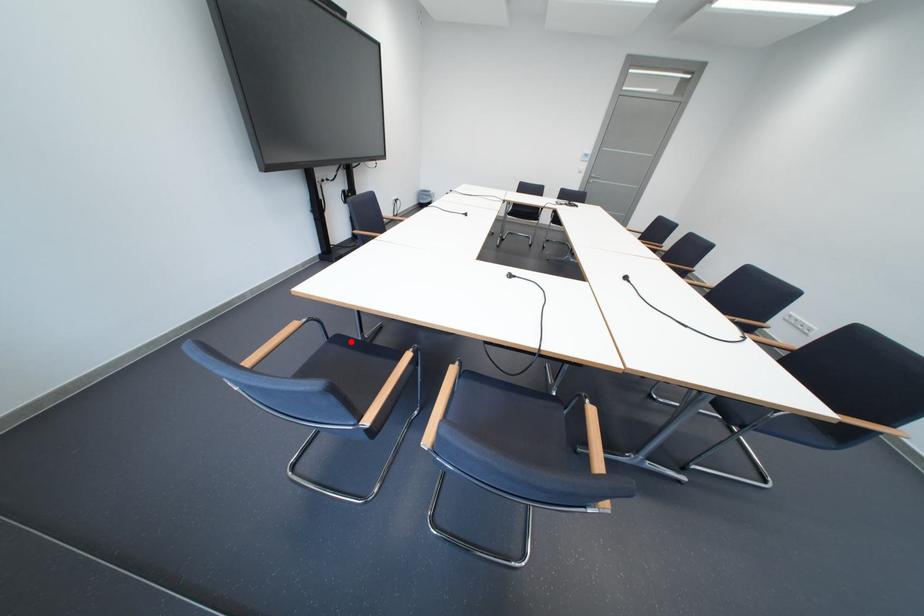
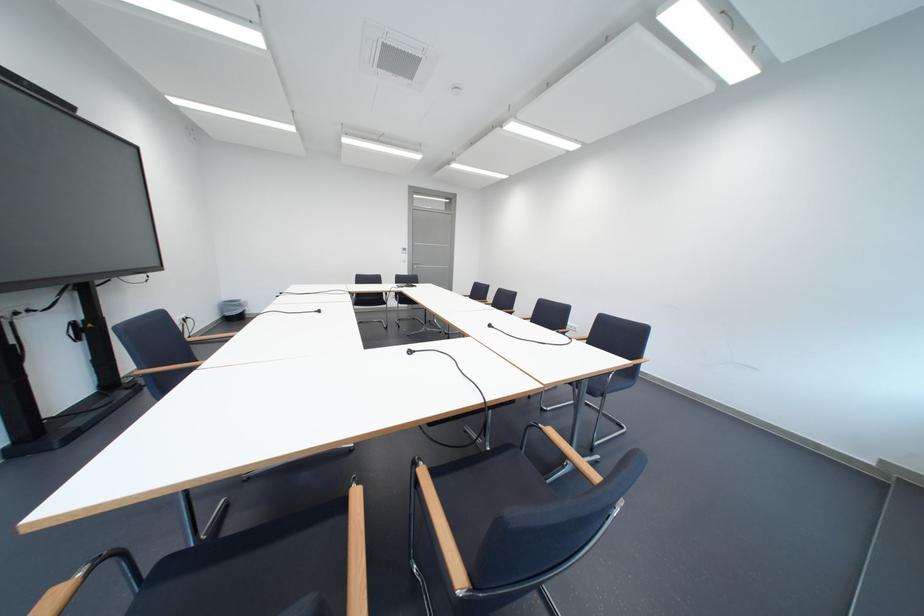
In the second image, find the point that corresponds to the highlighted location in the first image.

(178, 572)